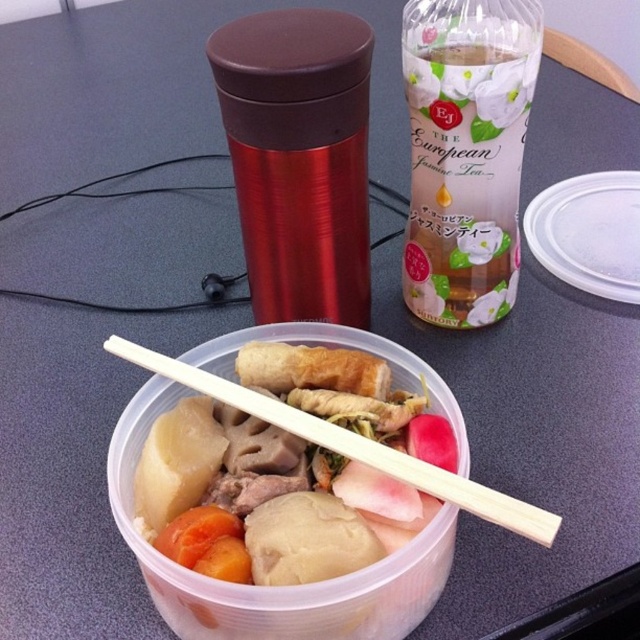
You are a delivery person who needs to place a small package between the white paper bottle at upper center and the wooden chopsticks at center. Can you fit it there?

The distance between the white paper bottle at upper center and the wooden chopsticks at center is 13.20 inches, so yes, the small package can fit in that space as long as its dimensions are smaller than 13.20 inches.

You are a food delivery person who needs to place a metallic red thermos at upper center and a white paper bottle at upper center into a rectangular box. The box has a width of 20 cm. If the thermos is 15 cm wide and the bottle is 8 cm wide, can both items fit side by side in the box?

The metallic red thermos at upper center is wider than the white paper bottle at upper center. Since the thermos is 15 cm wide and the bottle is 8 cm, combined they take up 23 cm. The box is only 20 cm wide, so they cannot fit side by side.

You are a guest at a dinner party and need to reach for the white paper bottle at upper center. However, there are wooden chopsticks at center in the way. Can you easily move the chopsticks to access the bottle?

The white paper bottle at upper center is much taller than the wooden chopsticks at center, so you can move the chopsticks aside to access the bottle since they are shorter and not obstructing the path.